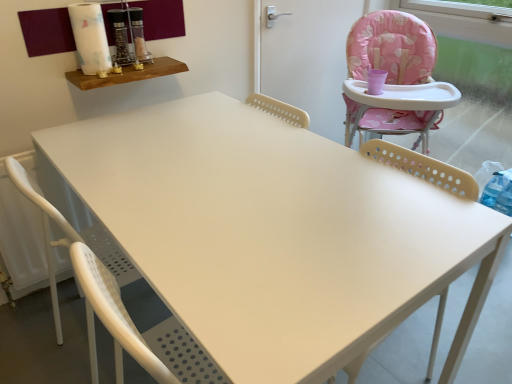
Question: Based on their sizes in the image, would you say wooden shelf at upper left is bigger or smaller than pink fabric screen door at upper right?

Choices:
 (A) big
 (B) small

Answer: (B)

Question: Which is correct: wooden shelf at upper left is inside pink fabric screen door at upper right, or outside of it?

Choices:
 (A) inside
 (B) outside

Answer: (B)

Question: Which of these objects is positioned farthest from the wooden shelf at upper left?

Choices:
 (A) pink fabric screen door at upper right
 (B) beige perforated chair at right, arranged as the 2th chair when viewed from the left
 (C) white perforated chair at lower left, the 2th chair in the right-to-left sequence

Answer: (B)

Question: Which object is positioned farthest from the white perforated chair at lower left, the 2th chair in the right-to-left sequence?

Choices:
 (A) pink fabric screen door at upper right
 (B) beige perforated chair at right, arranged as the 2th chair when viewed from the left
 (C) wooden shelf at upper left

Answer: (A)